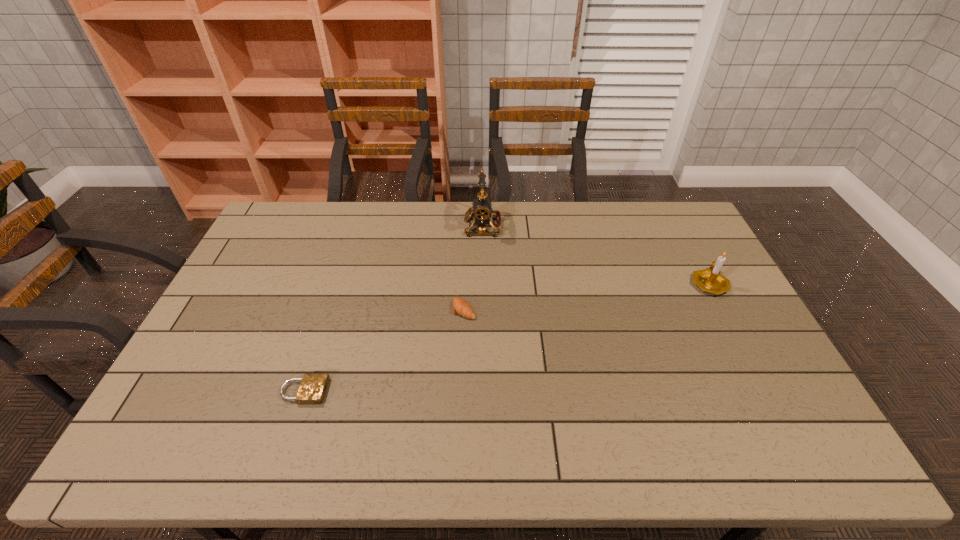
Where is `vacant position located 0.350m on the front of the farthest object, featuring the rotary dial`? Image resolution: width=960 pixels, height=540 pixels. vacant position located 0.350m on the front of the farthest object, featuring the rotary dial is located at coordinates (371, 226).

This screenshot has width=960, height=540. I want to click on vacant region located 0.370m on the front of the third nearest object, so click(774, 405).

At what (x,y) coordinates should I click in order to perform the action: click on vacant space located 0.170m on the front of the third farthest object. Please return your answer as a coordinate pair (x, y). Image resolution: width=960 pixels, height=540 pixels. Looking at the image, I should click on (462, 369).

In order to click on free region located 0.050m on the keyhole side of the leftmost object in this screenshot , I will do `click(346, 391)`.

The width and height of the screenshot is (960, 540). Find the location of `object that is at the far edge`. object that is at the far edge is located at coordinates (481, 212).

The image size is (960, 540). I want to click on object that is at the right edge, so click(x=710, y=280).

In the image, there is a desktop. Where is `free space at the far edge`? The image size is (960, 540). free space at the far edge is located at coordinates (464, 224).

In the image, there is a desktop. Identify the location of vacant region at the left edge. (233, 349).

Identify the location of blank area at the right edge. (765, 397).

What are the coordinates of `blank space at the far left corner of the desktop` in the screenshot? It's located at (294, 205).